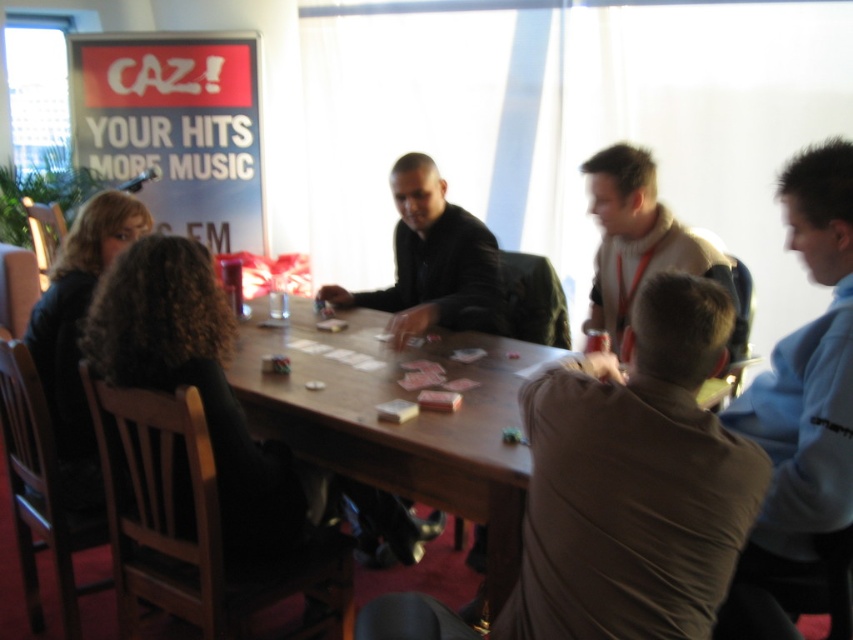
You are a photographer trying to capture a closeup of the light beige sweater at center without including the black leather jacket at center in the frame. Given their positions, is this possible?

The black leather jacket at center is above the light beige sweater at center, so if you position your camera below the black leather jacket at center, you can capture the light beige sweater at center without including the jacket.

You are sitting at the edge of the table and want to reach for the wooden at center and the light beige sweater at center. Which object is closer to you?

The wooden at center is closer to you than the light beige sweater at center.